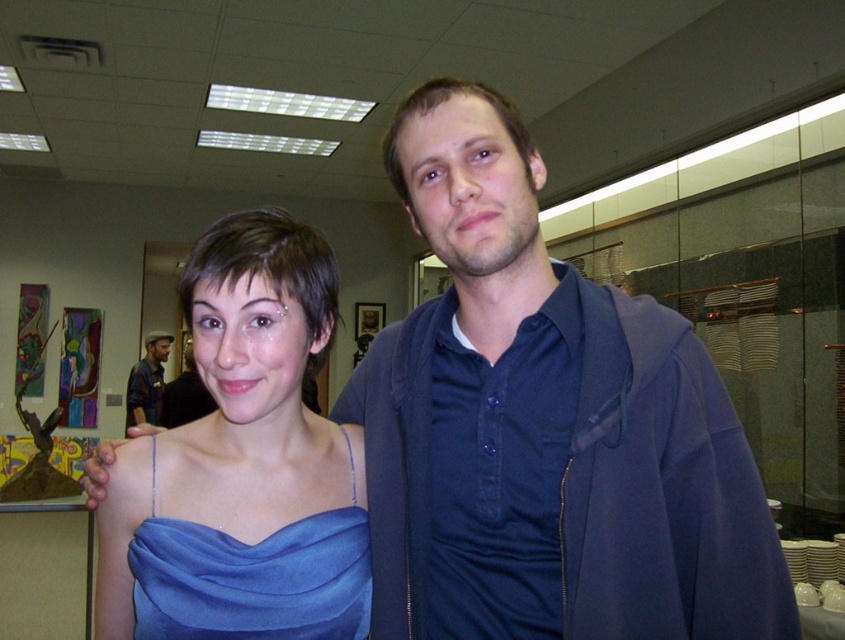
Is point (349, 483) closer to camera compared to point (347, 440)?

Yes.

This screenshot has width=845, height=640. I want to click on matte blue dress at center, so click(x=243, y=464).

Between point (323, 516) and point (143, 592), which one is positioned in front?

Positioned in front is point (143, 592).

Image resolution: width=845 pixels, height=640 pixels. I want to click on matte blue dress at center, so click(x=243, y=464).

I want to click on matte blue dress at center, so click(x=243, y=464).

Can you confirm if matte blue dress at center is thinner than plaid shirt at left?

Yes, matte blue dress at center is thinner than plaid shirt at left.

Between point (293, 499) and point (166, 336), which one is positioned in front?

Positioned in front is point (293, 499).

Locate an element on the screen. This screenshot has width=845, height=640. matte blue dress at center is located at coordinates (243, 464).

Can you confirm if satin blue dress at center is shorter than plaid shirt at left?

Correct, satin blue dress at center is not as tall as plaid shirt at left.

Is point (368, 582) closer to camera compared to point (161, 369)?

Yes, point (368, 582) is in front of point (161, 369).

Where is `satin blue dress at center`? satin blue dress at center is located at coordinates (252, 576).